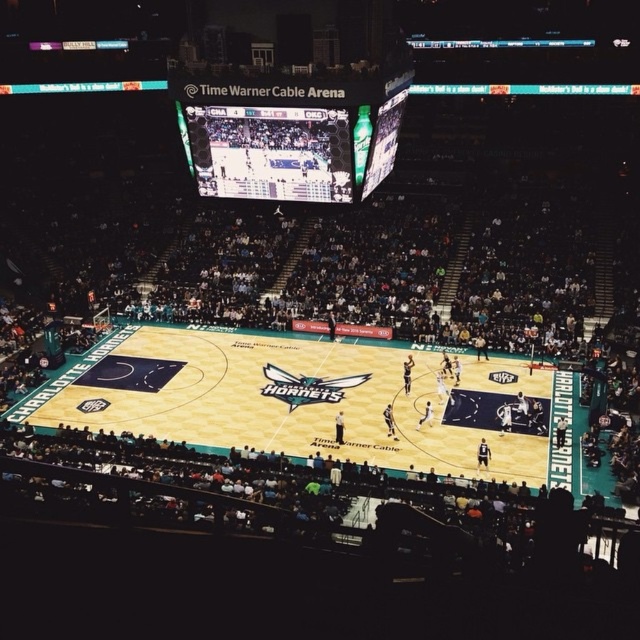
You are a photographer positioned at the back of the arena. You want to capture a photo that includes both the teal glossy basketball court at center and the matte black scoreboard at upper center. Based on their heights, which object should you focus on first to ensure both are in frame?

The teal glossy basketball court at center is taller than the matte black scoreboard at upper center. To ensure both are in frame, focus on the taller object first, which is the teal glossy basketball court at center, then adjust to include the matte black scoreboard at upper center.

You are a photographer standing at the back of the arena. You want to take a photo that includes both the teal glossy basketball court at center and the matte black scoreboard at upper center. Which object will appear larger in your photo?

The teal glossy basketball court at center will appear larger in the photo because it is closer to the photographer than the matte black scoreboard at upper center.